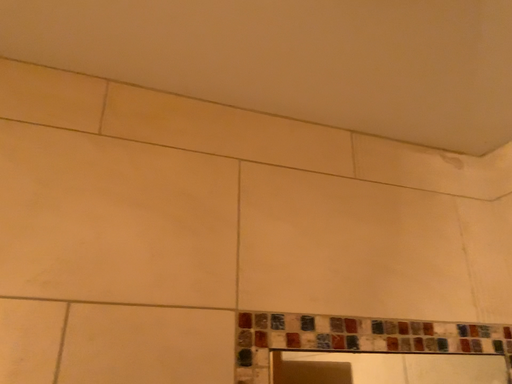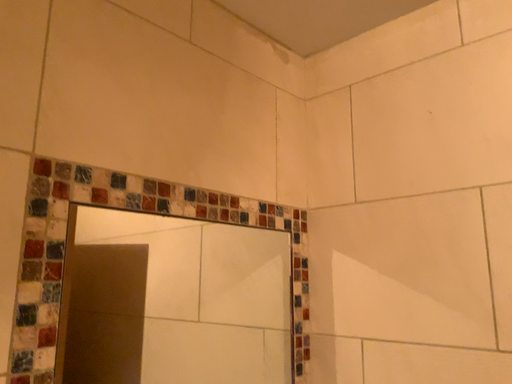
Question: How did the camera likely rotate when shooting the video?

Choices:
 (A) rotated downward
 (B) rotated upward

Answer: (A)